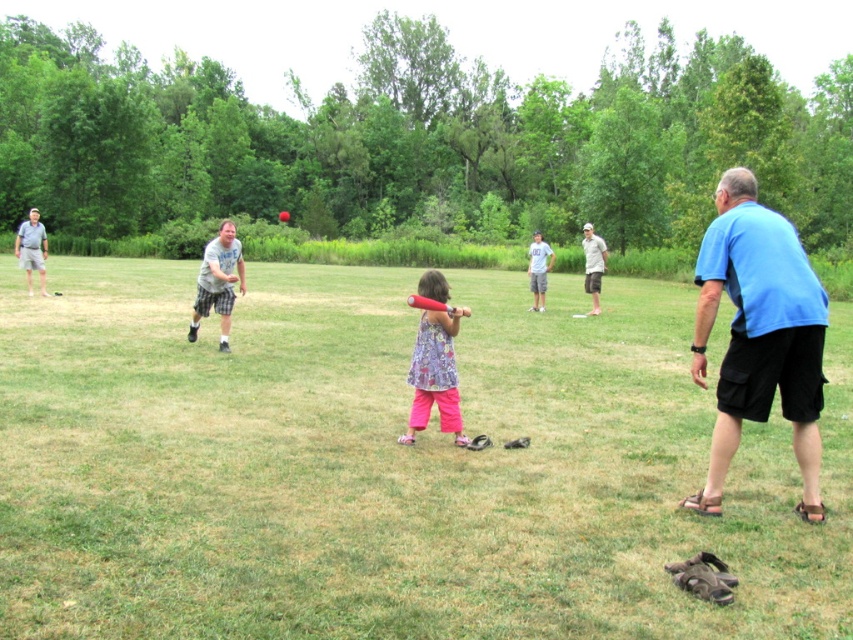
This screenshot has width=853, height=640. Identify the location of matte gray shorts at left. (218, 282).

The image size is (853, 640). Describe the element at coordinates (218, 282) in the screenshot. I see `matte gray shorts at left` at that location.

Describe the element at coordinates (218, 282) in the screenshot. I see `matte gray shorts at left` at that location.

You are a GUI agent. You are given a task and a screenshot of the screen. Output one action in this format:
    pyautogui.click(x=<x>, y=<y>)
    Task: Click on the matte gray shorts at left
    Image resolution: width=853 pixels, height=640 pixels.
    Given the screenshot: What is the action you would take?
    pyautogui.click(x=218, y=282)

Does point (770, 308) come closer to viewer compared to point (457, 310)?

Yes, point (770, 308) is closer to viewer.

You are a GUI agent. You are given a task and a screenshot of the screen. Output one action in this format:
    pyautogui.click(x=<x>, y=<y>)
    Task: Click on the blue t-shirt at right
    This screenshot has height=640, width=853.
    Given the screenshot: What is the action you would take?
    [x=759, y=333]

Is point (418, 340) closer to camera compared to point (583, 241)?

That is True.

Find the location of a particular element. The width and height of the screenshot is (853, 640). floral fabric dress at center is located at coordinates point(434,374).